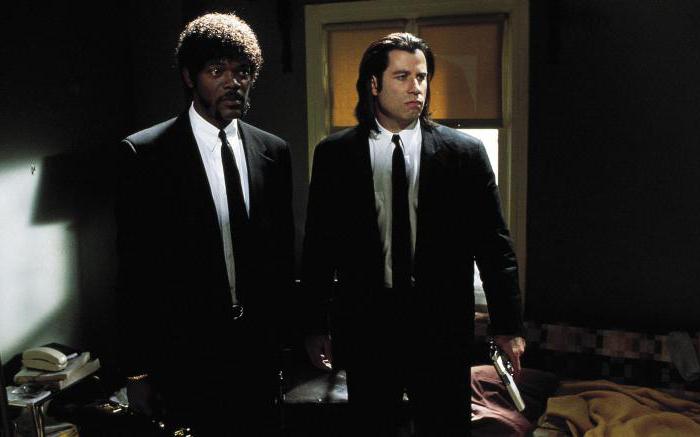
Find the location of a particular element. The width and height of the screenshot is (700, 437). phone is located at coordinates (43, 347).